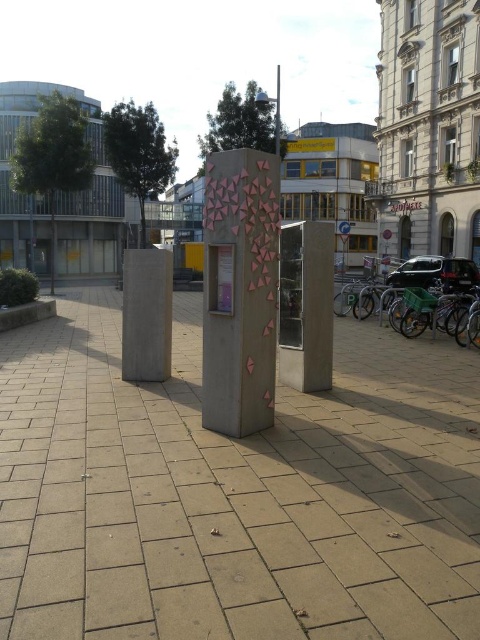
Question: Among these points, which one is farthest from the camera?

Choices:
 (A) (420, 579)
 (B) (303, 250)

Answer: (B)

Question: Can you confirm if pink textured pillar at center is bigger than concrete pillar at center?

Choices:
 (A) no
 (B) yes

Answer: (A)

Question: Can you confirm if pink textured pillar at center is positioned to the left of smooth concrete pole at center?

Choices:
 (A) no
 (B) yes

Answer: (B)

Question: Which of the following is the farthest from the observer?

Choices:
 (A) (277, 76)
 (B) (360, 304)

Answer: (A)

Question: Which object is the closest to the pink textured pillar at center?

Choices:
 (A) smooth concrete pole at center
 (B) concrete pillar at center
 (C) green plastic bicycle at right
 (D) brown concrete pavement at center

Answer: (B)

Question: Is pink textured pillar at center above sanded concrete pillar at center?

Choices:
 (A) no
 (B) yes

Answer: (A)